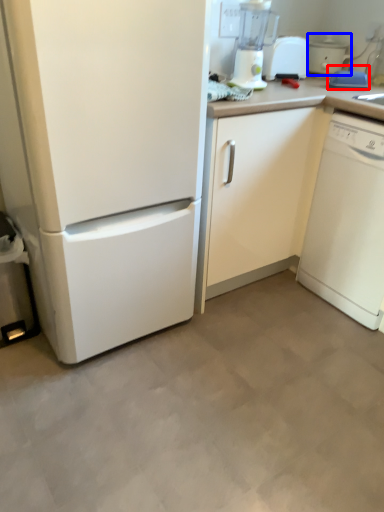
Question: Which object appears closest to the camera in this image, appliance (highlighted by a red box) or cooker (highlighted by a blue box)?

Choices:
 (A) appliance
 (B) cooker

Answer: (A)